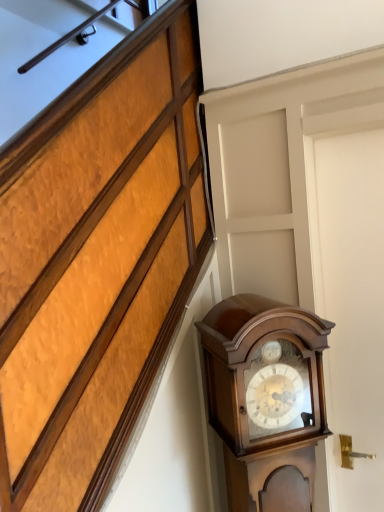
Question: Is polished wood grandfather clock at right taller than white matte door at right?

Choices:
 (A) no
 (B) yes

Answer: (A)

Question: From a real-world perspective, is polished wood grandfather clock at right beneath white matte door at right?

Choices:
 (A) no
 (B) yes

Answer: (B)

Question: Is polished wood grandfather clock at right oriented away from white matte door at right?

Choices:
 (A) yes
 (B) no

Answer: (B)

Question: Is the surface of polished wood grandfather clock at right in direct contact with white matte door at right?

Choices:
 (A) yes
 (B) no

Answer: (B)

Question: Can you confirm if polished wood grandfather clock at right is thinner than white matte door at right?

Choices:
 (A) yes
 (B) no

Answer: (B)

Question: Is the position of polished wood grandfather clock at right more distant than that of white matte door at right?

Choices:
 (A) no
 (B) yes

Answer: (A)

Question: Considering the relative sizes of white matte door at right and polished wood grandfather clock at right in the image provided, is white matte door at right taller than polished wood grandfather clock at right?

Choices:
 (A) no
 (B) yes

Answer: (B)

Question: Is white matte door at right turned away from polished wood grandfather clock at right?

Choices:
 (A) yes
 (B) no

Answer: (B)

Question: Can you confirm if white matte door at right is thinner than polished wood grandfather clock at right?

Choices:
 (A) no
 (B) yes

Answer: (B)

Question: Does white matte door at right lie behind polished wood grandfather clock at right?

Choices:
 (A) no
 (B) yes

Answer: (B)

Question: Is white matte door at right far away from polished wood grandfather clock at right?

Choices:
 (A) no
 (B) yes

Answer: (A)

Question: From the image's perspective, is white matte door at right located above polished wood grandfather clock at right?

Choices:
 (A) no
 (B) yes

Answer: (B)

Question: In the image, is white matte door at right positioned in front of or behind polished wood grandfather clock at right?

Choices:
 (A) behind
 (B) front

Answer: (A)